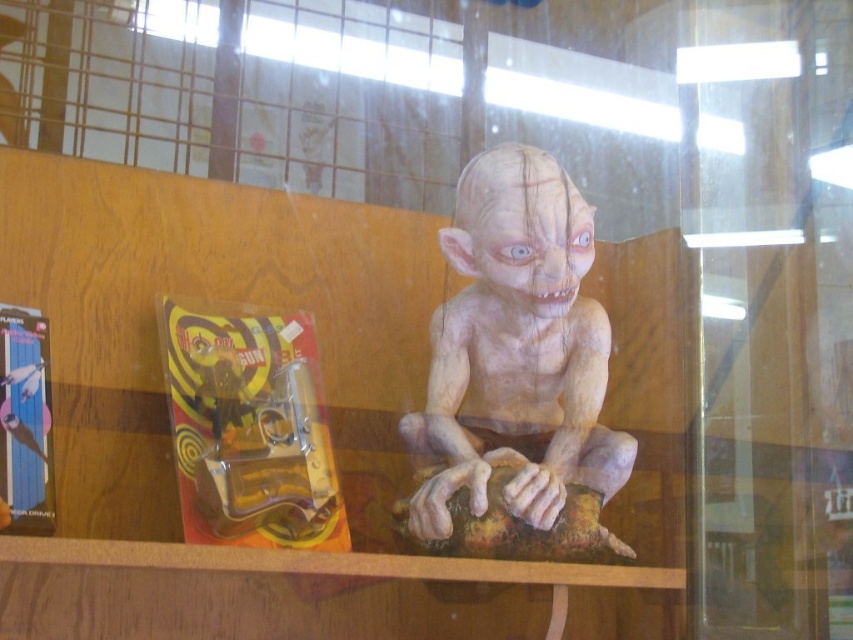
Does pale flesh-like zombie at center have a greater height compared to metallic silver gun at lower left?

Indeed, pale flesh-like zombie at center has a greater height compared to metallic silver gun at lower left.

Who is lower down, pale flesh-like zombie at center or metallic silver gun at lower left?

metallic silver gun at lower left is below.

This screenshot has height=640, width=853. In order to click on pale flesh-like zombie at center in this screenshot , I will do `click(515, 353)`.